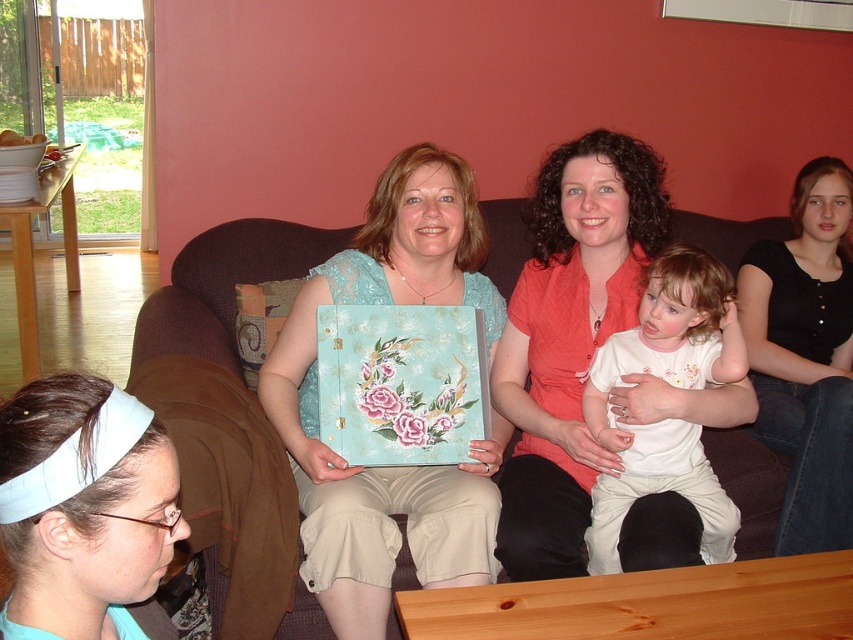
You are standing in the room and want to hand a book to the person wearing the matte coral blouse at center. Since the brown fabric couch at center is in the way, which side of the couch should you go around to reach the person?

You should go around the right side of the brown fabric couch at center because the matte coral blouse at center is located to the right of it.

You are planning to place a new decorative item on the coffee table in the scene. The item is 10 cm taller than the brown fabric couch at center. Can you place it on the coffee table without exceeding the height of the matte teal fabric album at center?

The matte teal fabric album at center is taller than the brown fabric couch at center. Since the new item is only 10 cm taller than the brown fabric couch at center, it may still be shorter than the matte teal fabric album at center depending on their exact heights. However, without knowing the exact height difference between the album and the couch, we cannot definitively determine if the item will fit under the album.